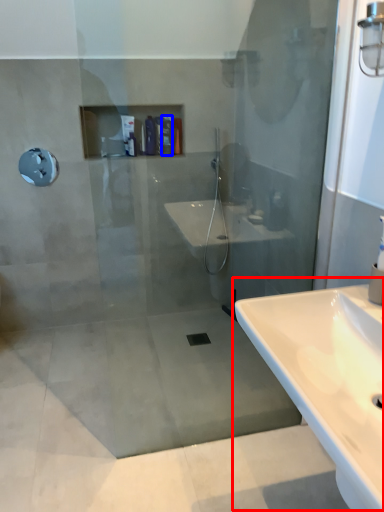
Question: Among these objects, which one is nearest to the camera, sink (highlighted by a red box) or toiletry (highlighted by a blue box)?

Choices:
 (A) sink
 (B) toiletry

Answer: (A)